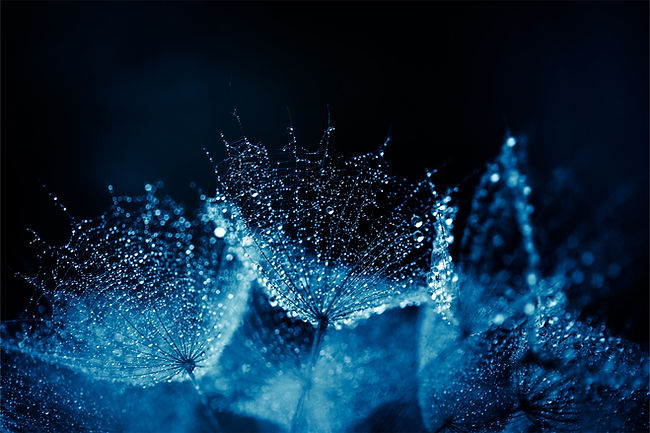
I want to click on plant, so click(549, 363).